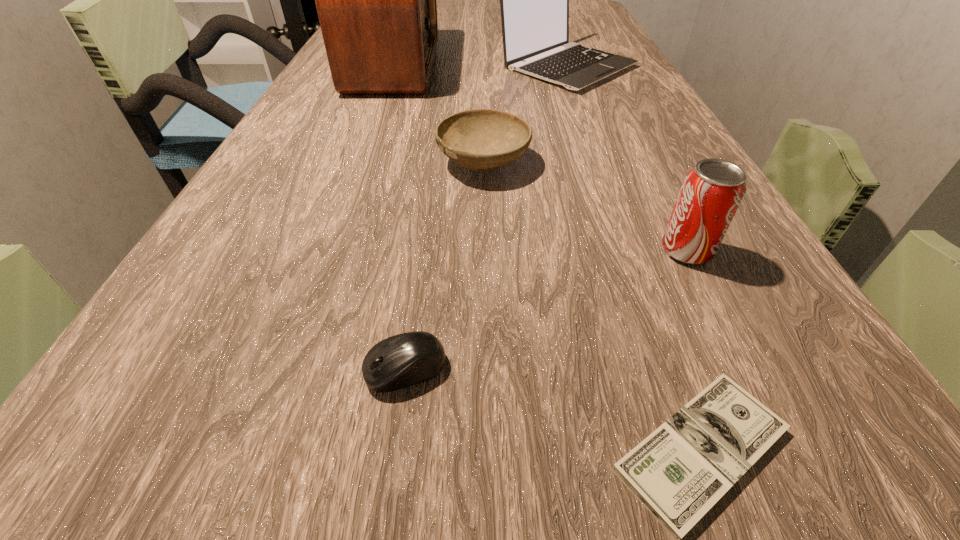
Where is `free space located 0.190m on the front of the third farthest object`? free space located 0.190m on the front of the third farthest object is located at coordinates (485, 272).

In order to click on vacant position located 0.240m on the left of the mouse in this screenshot , I will do `click(135, 369)`.

You are a GUI agent. You are given a task and a screenshot of the screen. Output one action in this format:
    pyautogui.click(x=<x>, y=<y>)
    Task: Click on the object situated at the left edge
    Image resolution: width=960 pixels, height=540 pixels.
    Given the screenshot: What is the action you would take?
    pyautogui.click(x=376, y=2)

Where is `laptop_computer that is positioned at the right edge`? The width and height of the screenshot is (960, 540). laptop_computer that is positioned at the right edge is located at coordinates (534, 0).

The width and height of the screenshot is (960, 540). Find the location of `soda can situated at the right edge`. soda can situated at the right edge is located at coordinates (712, 191).

This screenshot has width=960, height=540. I want to click on vacant area at the left edge, so pyautogui.click(x=281, y=213).

You are a GUI agent. You are given a task and a screenshot of the screen. Output one action in this format:
    pyautogui.click(x=<x>, y=<y>)
    Task: Click on the vacant space at the right edge of the desktop
    This screenshot has width=960, height=540.
    Given the screenshot: What is the action you would take?
    pyautogui.click(x=787, y=287)

Where is `free space at the far right corner of the desktop`? The image size is (960, 540). free space at the far right corner of the desktop is located at coordinates (590, 5).

Where is `free spot between the radio receiver and the fourth shortest object`? The height and width of the screenshot is (540, 960). free spot between the radio receiver and the fourth shortest object is located at coordinates (540, 158).

What are the coordinates of `free space that is in between the radio receiver and the fifth tallest object` in the screenshot? It's located at (399, 217).